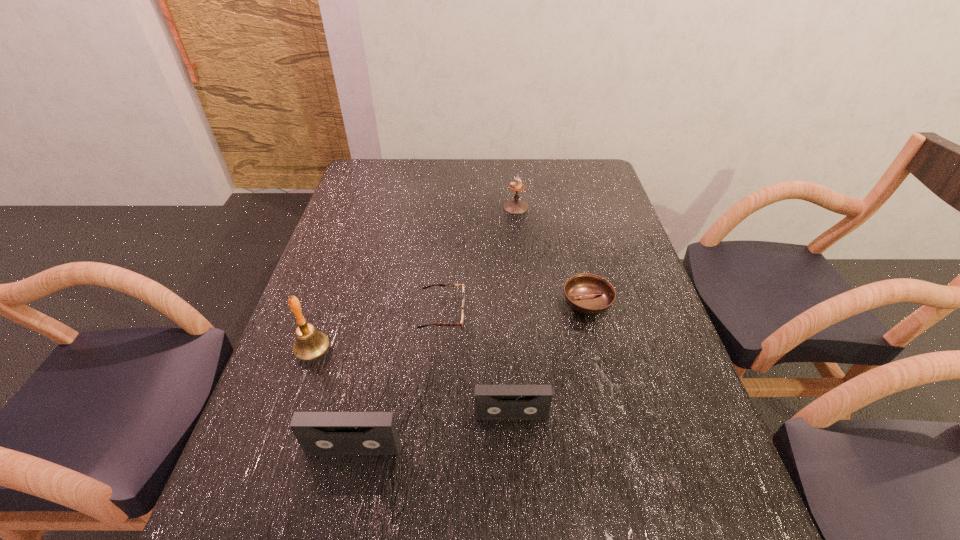
With all videotapes evenly spaced, where should an extra videotape be placed on the right to continue the pattern? Please point out a vacant space. Please provide its 2D coordinates. Your answer should be formatted as a tuple, i.e. [(x, y)], where the tuple contains the x and y coordinates of a point satisfying the conditions above.

[(652, 385)]